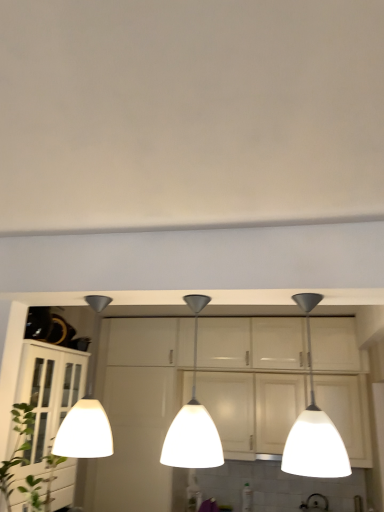
Question: Does white glossy cabinet at left lie in front of green leafy plant at lower left?

Choices:
 (A) no
 (B) yes

Answer: (A)

Question: Could you tell me if white glossy cabinet at left is facing green leafy plant at lower left?

Choices:
 (A) no
 (B) yes

Answer: (A)

Question: Does white glossy cabinet at left lie behind green leafy plant at lower left?

Choices:
 (A) yes
 (B) no

Answer: (A)

Question: Is white glossy cabinet at left in contact with green leafy plant at lower left?

Choices:
 (A) no
 (B) yes

Answer: (A)

Question: Is white glossy cabinet at left oriented away from green leafy plant at lower left?

Choices:
 (A) no
 (B) yes

Answer: (A)

Question: From the image's perspective, is white glossy cabinet at left over green leafy plant at lower left?

Choices:
 (A) no
 (B) yes

Answer: (A)

Question: Is the depth of white glossy pendant light at left, arranged as the third lamp when viewed from the right, greater than that of green leafy plant at lower left?

Choices:
 (A) yes
 (B) no

Answer: (A)

Question: Is white glossy pendant light at left, which is the first lamp in left-to-right order, taller than green leafy plant at lower left?

Choices:
 (A) yes
 (B) no

Answer: (A)

Question: Can you confirm if white glossy pendant light at left, arranged as the third lamp when viewed from the right, is bigger than green leafy plant at lower left?

Choices:
 (A) yes
 (B) no

Answer: (A)

Question: Is green leafy plant at lower left surrounded by white glossy pendant light at left, arranged as the third lamp when viewed from the right?

Choices:
 (A) no
 (B) yes

Answer: (A)

Question: From the image's perspective, would you say white glossy pendant light at left, which is the first lamp in left-to-right order, is positioned over green leafy plant at lower left?

Choices:
 (A) yes
 (B) no

Answer: (A)

Question: Is the surface of white glossy pendant light at left, arranged as the third lamp when viewed from the right, in direct contact with green leafy plant at lower left?

Choices:
 (A) no
 (B) yes

Answer: (A)

Question: Considering the relative sizes of green leafy plant at lower left and white glass pendant light at center, which ranks as the second lamp in left-to-right order, in the image provided, is green leafy plant at lower left taller than white glass pendant light at center, which ranks as the second lamp in left-to-right order,?

Choices:
 (A) no
 (B) yes

Answer: (A)